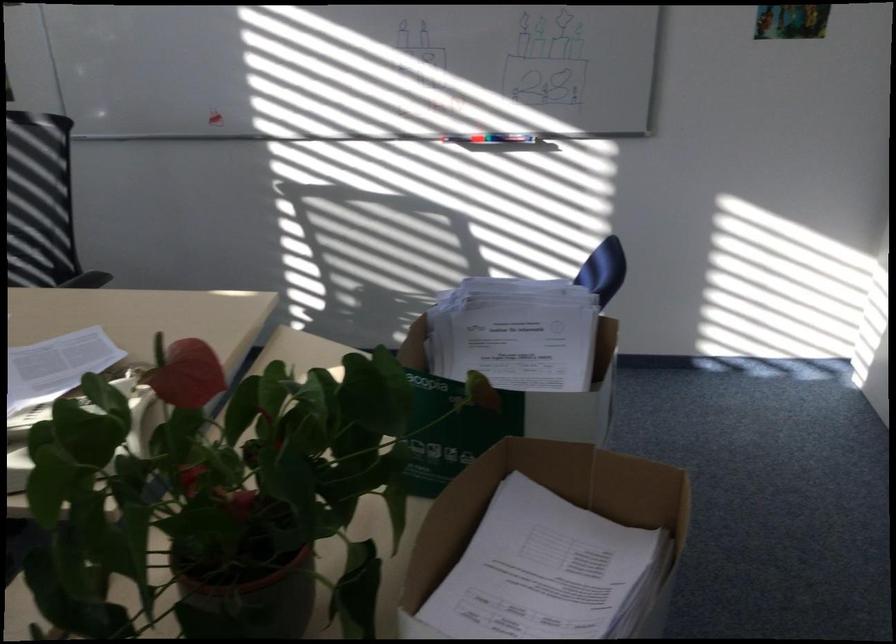
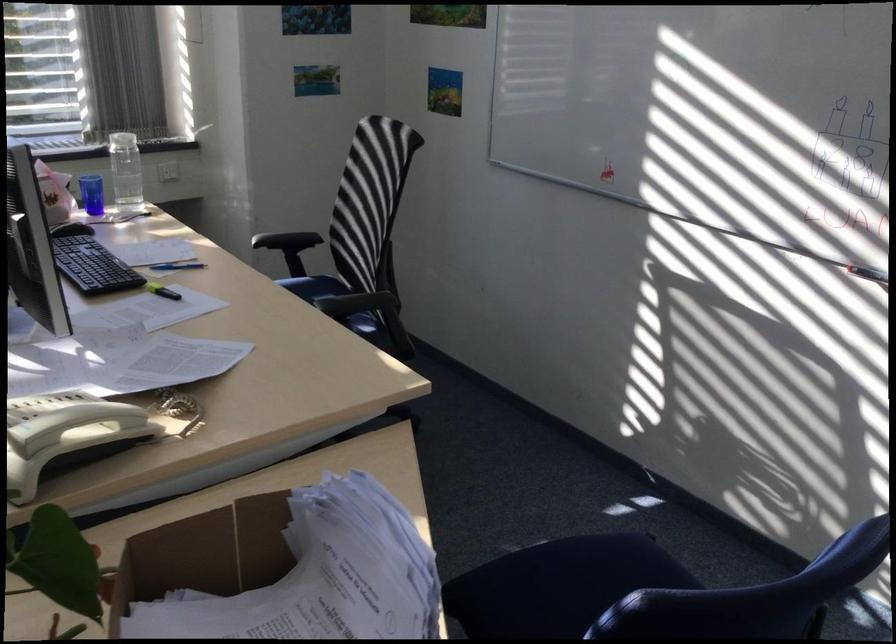
In the second image, find the point that corresponds to [477,350] in the first image.

(319, 576)